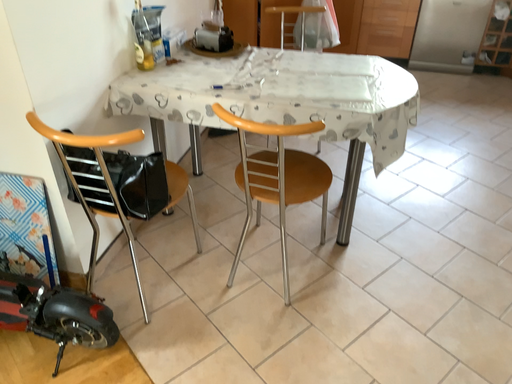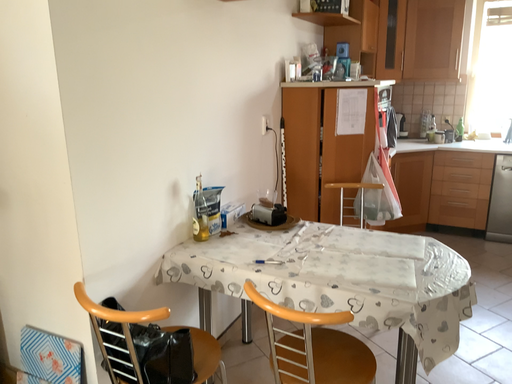
Question: Which way did the camera rotate in the video?

Choices:
 (A) rotated upward
 (B) rotated downward

Answer: (A)